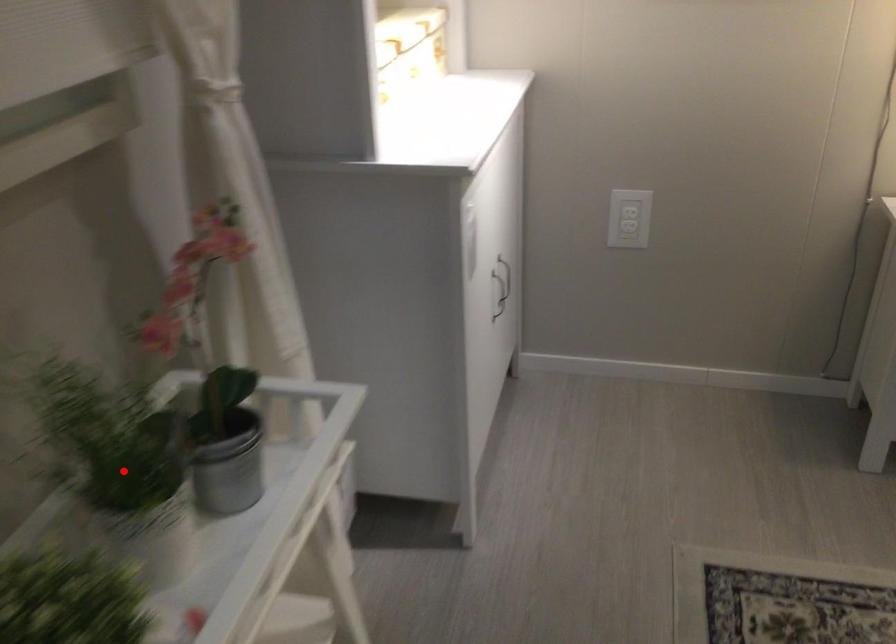
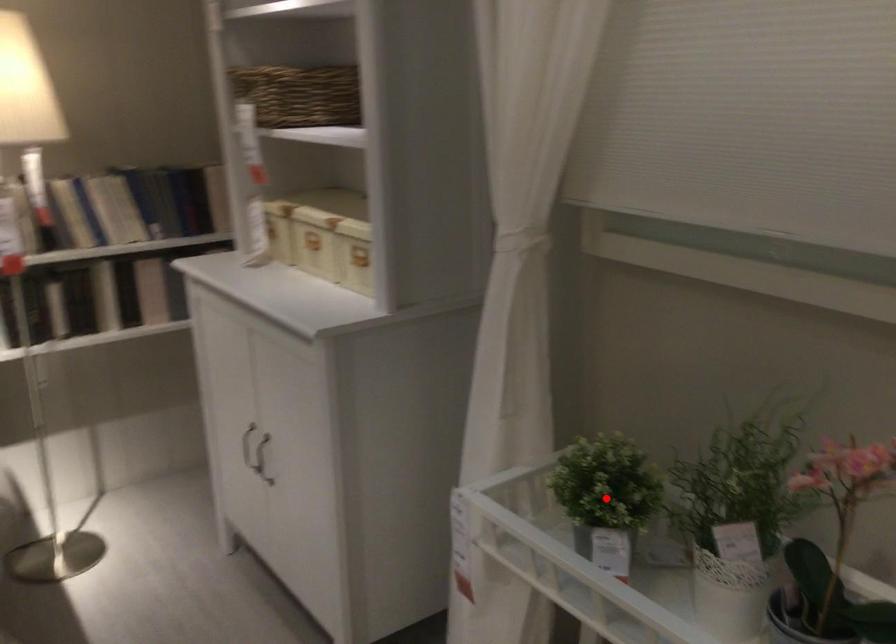
I am providing you with two images of the same scene from different viewpoints. A red point is marked on the first image and another point is marked on the second image. Is the marked point in image1 the same physical position as the marked point in image2?

No